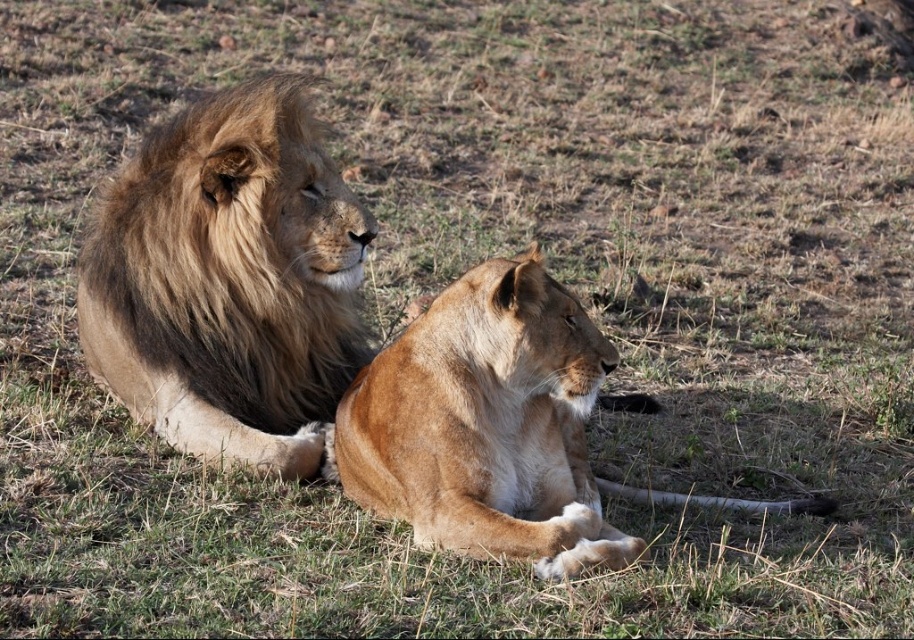
You are standing 10 feet away from the point marked as point (x=348, y=243) in the image. Can you reach the point without moving closer than your current position?

The distance of point (x=348, y=243) from viewer is 11.13 feet, so you are currently 10 feet away, which is closer than the point. Therefore, you can reach the point without moving closer than your current position.

Based on the photo, you are a wildlife photographer aiming to capture a photo of both the golden fur lion at upper left and the golden fur lion at center. Since you want to ensure both lions are clearly visible in your shot, which lion should you focus on first to account for their size difference?

The golden fur lion at upper left is taller than the golden fur lion at center. Therefore, you should focus on the golden fur lion at upper left first because its larger size may require more precise focus to ensure clarity in the photograph.